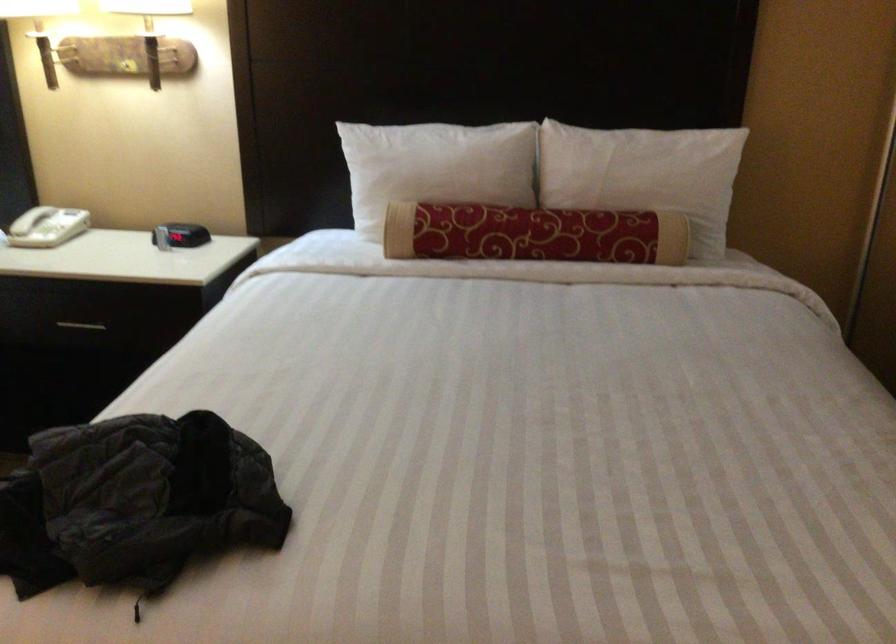
At what (x,y) coordinates should I click in order to perform the action: click on white telephone handset. Please return your answer as a coordinate pair (x, y). The height and width of the screenshot is (644, 896). Looking at the image, I should click on (30, 220).